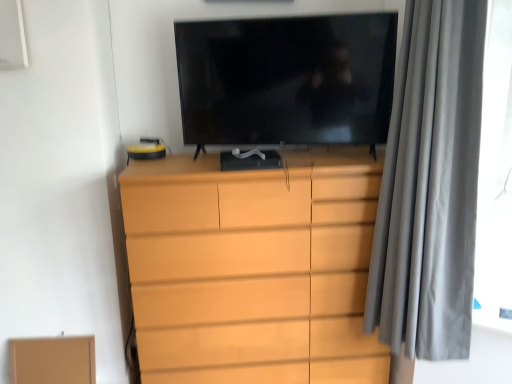
Describe the element at coordinates (52, 360) in the screenshot. I see `brown cardboard box at lower left` at that location.

Measure the distance between gray velvet curtain at right and camera.

A distance of 1.41 meters exists between gray velvet curtain at right and camera.

The image size is (512, 384). What are the coordinates of `gray velvet curtain at right` in the screenshot? It's located at (430, 185).

Find the location of a particular element. This screenshot has width=512, height=384. black glossy tv at center is located at coordinates (287, 80).

Locate an element on the screen. The height and width of the screenshot is (384, 512). brown cardboard box at lower left is located at coordinates (52, 360).

From the image's perspective, does brown cardboard box at lower left appear higher than gray velvet curtain at right?

No, from the image's perspective, brown cardboard box at lower left is not above gray velvet curtain at right.

Considering the positions of objects brown cardboard box at lower left and gray velvet curtain at right in the image provided, who is more to the left, brown cardboard box at lower left or gray velvet curtain at right?

Positioned to the left is brown cardboard box at lower left.

From a real-world perspective, is brown cardboard box at lower left physically above gray velvet curtain at right?

No, from a real-world perspective, brown cardboard box at lower left is not on top of gray velvet curtain at right.

Which of these two, gray velvet curtain at right or matte wood chest of drawers at center, is bigger?

matte wood chest of drawers at center.

From a real-world perspective, is gray velvet curtain at right positioned under matte wood chest of drawers at center based on gravity?

No, from a real-world perspective, gray velvet curtain at right is not below matte wood chest of drawers at center.

Which object is wider, gray velvet curtain at right or matte wood chest of drawers at center?

matte wood chest of drawers at center is wider.

Is the surface of gray velvet curtain at right in direct contact with matte wood chest of drawers at center?

No, gray velvet curtain at right is not making contact with matte wood chest of drawers at center.

Who is smaller, matte wood chest of drawers at center or brown cardboard box at lower left?

Smaller between the two is brown cardboard box at lower left.

Who is shorter, matte wood chest of drawers at center or brown cardboard box at lower left?

Standing shorter between the two is brown cardboard box at lower left.

Could you tell me if matte wood chest of drawers at center is facing brown cardboard box at lower left?

No, matte wood chest of drawers at center is not facing towards brown cardboard box at lower left.

You are a GUI agent. You are given a task and a screenshot of the screen. Output one action in this format:
    pyautogui.click(x=<x>, y=<y>)
    Task: Click on the cardboard box on the left of matte wood chest of drawers at center
    
    Given the screenshot: What is the action you would take?
    point(52,360)

Can you confirm if brown cardboard box at lower left is positioned to the right of black glossy tv at center?

In fact, brown cardboard box at lower left is to the left of black glossy tv at center.

From a real-world perspective, is brown cardboard box at lower left above or below black glossy tv at center?

In terms of real-world spatial position, brown cardboard box at lower left is below black glossy tv at center.

Does brown cardboard box at lower left have a smaller size compared to black glossy tv at center?

Correct, brown cardboard box at lower left occupies less space than black glossy tv at center.

Would you consider brown cardboard box at lower left to be distant from black glossy tv at center?

brown cardboard box at lower left is far away from black glossy tv at center.

Does point (350, 121) come farther from viewer compared to point (85, 373)?

No, (350, 121) is in front of (85, 373).

Would you consider black glossy tv at center to be distant from brown cardboard box at lower left?

black glossy tv at center is positioned a significant distance from brown cardboard box at lower left.

Can you tell me how much black glossy tv at center and brown cardboard box at lower left differ in facing direction?

black glossy tv at center and brown cardboard box at lower left are facing 14 degrees away from each other.

In the scene shown: Between black glossy tv at center and brown cardboard box at lower left, which one is positioned behind?

brown cardboard box at lower left is more distant.

Considering the sizes of objects matte wood chest of drawers at center and black glossy tv at center in the image provided, who is bigger, matte wood chest of drawers at center or black glossy tv at center?

Bigger between the two is matte wood chest of drawers at center.

Considering the positions of objects matte wood chest of drawers at center and black glossy tv at center in the image provided, who is more to the right, matte wood chest of drawers at center or black glossy tv at center?

From the viewer's perspective, black glossy tv at center appears more on the right side.

Is point (295, 318) positioned after point (206, 59)?

That is True.

Locate an element on the screen. This screenshot has width=512, height=384. television above the matte wood chest of drawers at center (from a real-world perspective) is located at coordinates (287, 80).

Considering the positions of point (74, 377) and point (292, 308), is point (74, 377) closer or farther from the camera than point (292, 308)?

Point (74, 377).

Could matte wood chest of drawers at center be considered to be inside brown cardboard box at lower left?

That's incorrect, matte wood chest of drawers at center is not inside brown cardboard box at lower left.

Does brown cardboard box at lower left have a greater width compared to matte wood chest of drawers at center?

No, brown cardboard box at lower left is not wider than matte wood chest of drawers at center.

Consider the image. Considering the positions of objects brown cardboard box at lower left and matte wood chest of drawers at center in the image provided, who is more to the left, brown cardboard box at lower left or matte wood chest of drawers at center?

From the viewer's perspective, brown cardboard box at lower left appears more on the left side.

The image size is (512, 384). Find the location of `cardboard box below the gray velvet curtain at right (from a real-world perspective)`. cardboard box below the gray velvet curtain at right (from a real-world perspective) is located at coordinates (52, 360).

I want to click on curtain above the matte wood chest of drawers at center (from the image's perspective), so click(430, 185).

Consider the image. Which object lies further to the anchor point matte wood chest of drawers at center, brown cardboard box at lower left or black glossy tv at center?

brown cardboard box at lower left.

Considering their positions, is gray velvet curtain at right positioned further to matte wood chest of drawers at center than brown cardboard box at lower left?

brown cardboard box at lower left is further to matte wood chest of drawers at center.

Considering their positions, is black glossy tv at center positioned closer to gray velvet curtain at right than brown cardboard box at lower left?

black glossy tv at center is closer to gray velvet curtain at right.

From the image, which object appears to be farther from matte wood chest of drawers at center, black glossy tv at center or brown cardboard box at lower left?

Among the two, brown cardboard box at lower left is located further to matte wood chest of drawers at center.

Considering their positions, is black glossy tv at center positioned further to brown cardboard box at lower left than gray velvet curtain at right?

Among the two, gray velvet curtain at right is located further to brown cardboard box at lower left.

Looking at the image, which one is located further to brown cardboard box at lower left, matte wood chest of drawers at center or black glossy tv at center?

The object further to brown cardboard box at lower left is black glossy tv at center.

In the scene shown: Considering their positions, is black glossy tv at center positioned further to brown cardboard box at lower left than matte wood chest of drawers at center?

black glossy tv at center is further to brown cardboard box at lower left.

Considering their positions, is gray velvet curtain at right positioned further to brown cardboard box at lower left than matte wood chest of drawers at center?

gray velvet curtain at right lies further to brown cardboard box at lower left than the other object.

Find the location of a particular element. curtain between black glossy tv at center and matte wood chest of drawers at center in the vertical direction is located at coordinates (430, 185).

This screenshot has height=384, width=512. I want to click on chest of drawers between black glossy tv at center and brown cardboard box at lower left from top to bottom, so click(253, 269).

Locate an element on the screen. The image size is (512, 384). television located between brown cardboard box at lower left and gray velvet curtain at right in the left-right direction is located at coordinates (287, 80).

You are a GUI agent. You are given a task and a screenshot of the screen. Output one action in this format:
    pyautogui.click(x=<x>, y=<y>)
    Task: Click on the chest of drawers located between brown cardboard box at lower left and gray velvet curtain at right in the left-right direction
    
    Given the screenshot: What is the action you would take?
    pyautogui.click(x=253, y=269)